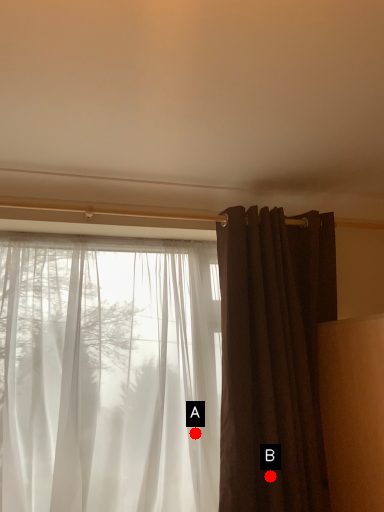
Question: Two points are circled on the image, labeled by A and B beside each circle. Which point is closer to the camera?

Choices:
 (A) A is closer
 (B) B is closer

Answer: (B)